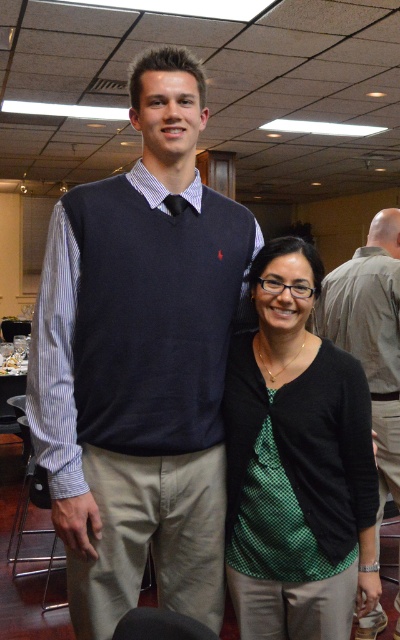
Question: Can you confirm if dark blue sweater vest at center is positioned to the left of dark blue sweater vest at upper left?

Choices:
 (A) yes
 (B) no

Answer: (A)

Question: Which object is the closest to the dark blue sweater vest at upper left?

Choices:
 (A) dark blue sweater vest at center
 (B) green dotted shirt at center

Answer: (B)

Question: Which is farther from the green dotted shirt at center?

Choices:
 (A) dark blue sweater vest at upper left
 (B) dark blue sweater vest at center

Answer: (A)

Question: Can you confirm if green dotted shirt at center is positioned below dark blue sweater vest at upper left?

Choices:
 (A) yes
 (B) no

Answer: (A)

Question: Can you confirm if green dotted shirt at center is bigger than dark blue sweater vest at upper left?

Choices:
 (A) no
 (B) yes

Answer: (A)

Question: Which point appears closest to the camera in this image?

Choices:
 (A) (176, 141)
 (B) (236, 344)

Answer: (A)